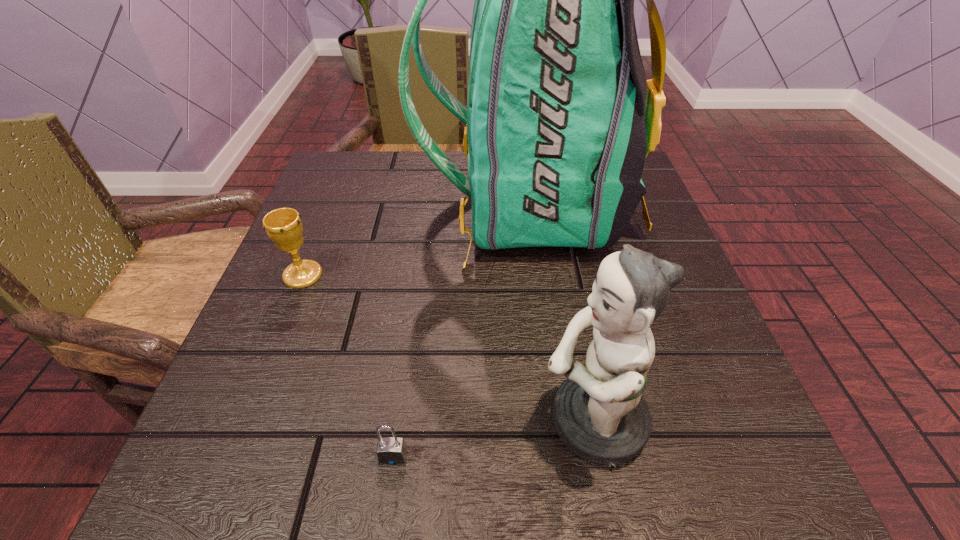
Identify the location of vacant region between the leftmost object and the backpack. The width and height of the screenshot is (960, 540). (416, 242).

The image size is (960, 540). I want to click on free spot between the second shortest object and the tallest object, so click(416, 242).

This screenshot has width=960, height=540. Find the location of `vacant space that is in between the second tallest object and the tallest object`. vacant space that is in between the second tallest object and the tallest object is located at coordinates (560, 315).

This screenshot has width=960, height=540. Find the location of `object that ranks as the second closest to the shortest object`. object that ranks as the second closest to the shortest object is located at coordinates pos(560,117).

Image resolution: width=960 pixels, height=540 pixels. I want to click on object that stands as the second closest to the backpack, so point(599,412).

At what (x,y) coordinates should I click in order to perform the action: click on free space in the image that satisfies the following two spatial constraints: 1. on the back of the tallest object; 2. on the shackle of the padlock. Please return your answer as a coordinate pair (x, y). Looking at the image, I should click on (562, 456).

Locate an element on the screen. Image resolution: width=960 pixels, height=540 pixels. vacant space that satisfies the following two spatial constraints: 1. on the front-facing side of the third shortest object; 2. on the shackle of the padlock is located at coordinates (598, 456).

Where is `free space that satisfies the following two spatial constraints: 1. on the front-facing side of the figurine; 2. on the shackle of the shortest object`? free space that satisfies the following two spatial constraints: 1. on the front-facing side of the figurine; 2. on the shackle of the shortest object is located at coordinates (598, 456).

The width and height of the screenshot is (960, 540). Identify the location of vacant space that satisfies the following two spatial constraints: 1. on the front-facing side of the figurine; 2. on the shackle of the padlock. (598, 456).